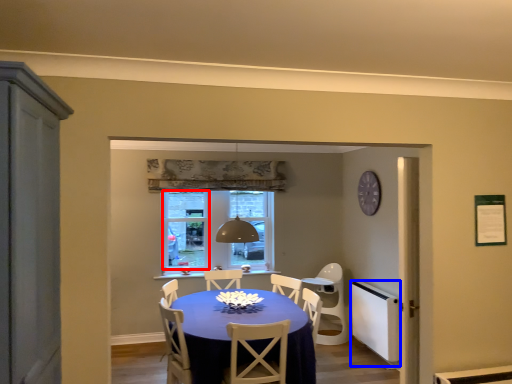
Question: Which point is closer to the camera, window screen (highlighted by a red box) or appliance (highlighted by a blue box)?

Choices:
 (A) window screen
 (B) appliance

Answer: (B)